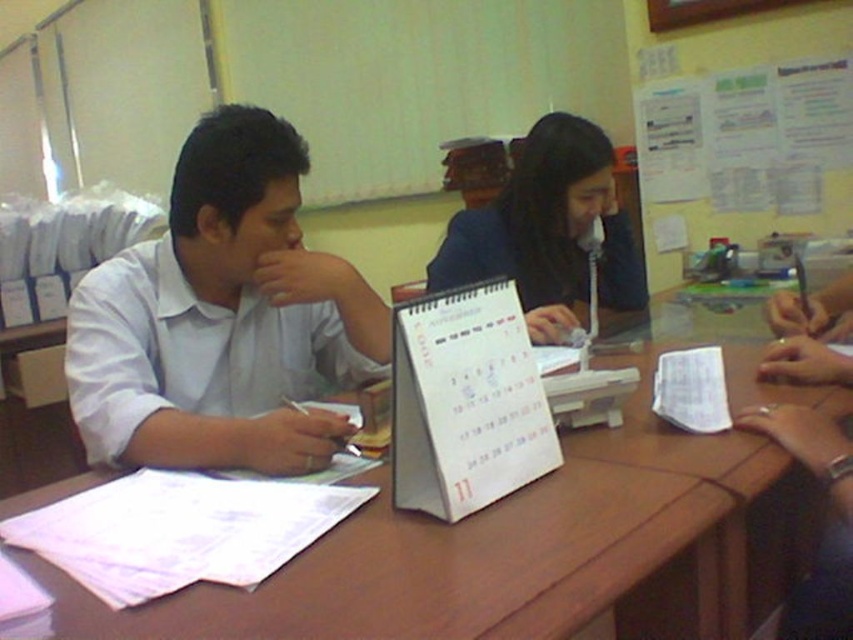
You are a student who needs to reach the wooden table at center from where the white shirt at left is located. Can you comfortably reach the table without moving your chair? Please explain your reasoning.

The distance between the wooden table at center and the white shirt at left is 38.66 centimeters. Since the average human arm length is about 70 centimeters, you can comfortably reach the wooden table at center without moving your chair.